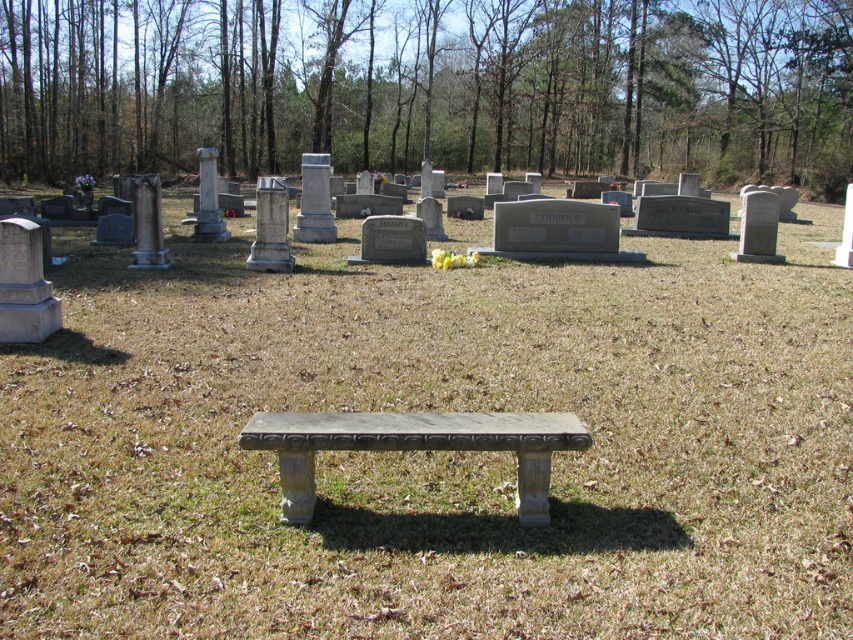
You are standing at the center of the cemetery and see the green grass at center. Where would you find it relative to your current position?

The green grass at center is located at point (x=434, y=452) relative to your current position.